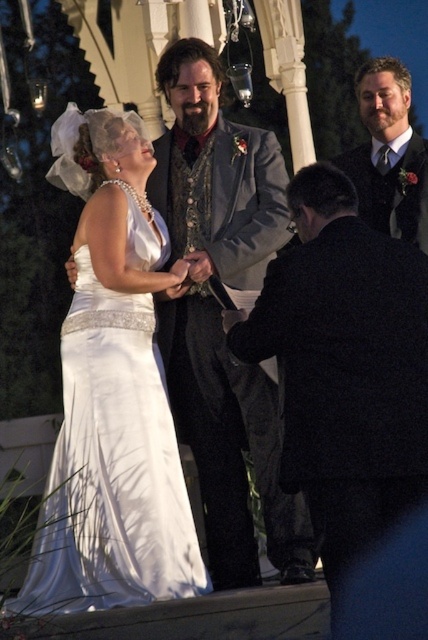
Question: Does black wool coat at lower right have a larger size compared to shiny black suit at center?

Choices:
 (A) yes
 (B) no

Answer: (A)

Question: Considering the relative positions of white satin dress at center and shiny black suit at center in the image provided, where is white satin dress at center located with respect to shiny black suit at center?

Choices:
 (A) right
 (B) left

Answer: (B)

Question: Which of these objects is positioned closest to the black wool coat at lower right?

Choices:
 (A) shiny black suit at center
 (B) white satin dress at center

Answer: (B)

Question: Is matte gray vest at center to the left of shiny black suit at center from the viewer's perspective?

Choices:
 (A) no
 (B) yes

Answer: (B)

Question: Among these objects, which one is farthest from the camera?

Choices:
 (A) matte gray vest at center
 (B) white satin dress at center

Answer: (A)

Question: Based on their relative distances, which object is farther from the black wool coat at lower right?

Choices:
 (A) matte gray vest at center
 (B) white satin dress at center

Answer: (B)